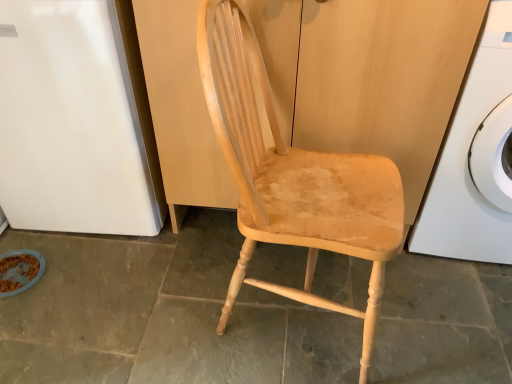
Find the location of a particular element. Image resolution: width=512 pixels, height=384 pixels. vacant space underneath brown crumbly food at lower left (from a real-world perspective) is located at coordinates click(x=18, y=282).